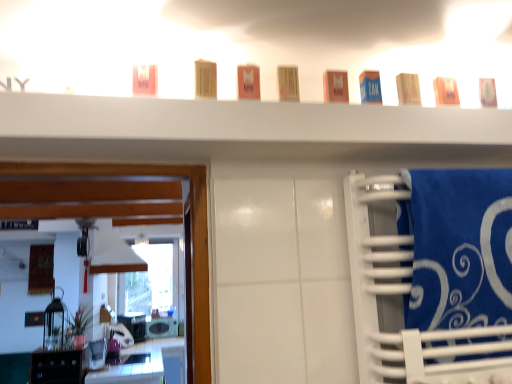
The image size is (512, 384). What are the coordinates of `matte orange soap at upper right, which ranks as the eighth toiletry in left-to-right order` in the screenshot? It's located at (446, 91).

Describe the element at coordinates (97, 354) in the screenshot. I see `metallic silver toaster at lower left, which appears as the first appliance when viewed from the front` at that location.

Based on the photo, in order to face metallic silver toaster at lower left, the second appliance when ordered from back to front, should I rotate leftwards or rightwards?

It's best to rotate left around 20.019 degrees.

Where is `matte orange box at center, positioned as the 4th toiletry in right-to-left order`? Image resolution: width=512 pixels, height=384 pixels. matte orange box at center, positioned as the 4th toiletry in right-to-left order is located at coordinates (335, 86).

You are a GUI agent. You are given a task and a screenshot of the screen. Output one action in this format:
    pyautogui.click(x=<x>, y=<y>)
    Task: Click on the matte beige soap at upper right, the 2th toiletry in the right-to-left sequence
    Image resolution: width=512 pixels, height=384 pixels.
    Given the screenshot: What is the action you would take?
    pyautogui.click(x=408, y=89)

Where is `matte orange soap at upper right, which ranks as the eighth toiletry in left-to-right order`? matte orange soap at upper right, which ranks as the eighth toiletry in left-to-right order is located at coordinates (446, 91).

Does glossy white vanity at lower left contain orange matte box at center, which is the 6th toiletry in right-to-left order?

No, orange matte box at center, which is the 6th toiletry in right-to-left order, is located outside of glossy white vanity at lower left.

From the image's perspective, is glossy white vanity at lower left located above or below orange matte box at center, which is the 6th toiletry in right-to-left order?

Based on their image positions, glossy white vanity at lower left is located beneath orange matte box at center, which is the 6th toiletry in right-to-left order.

From a real-world perspective, which is physically above, glossy white vanity at lower left or orange matte box at center, which is the 6th toiletry in right-to-left order?

orange matte box at center, which is the 6th toiletry in right-to-left order, is physically above.

Can you confirm if wooden block at center, placed as the second toiletry when sorted from left to right, is wider than white matte vent at center?

No, wooden block at center, placed as the second toiletry when sorted from left to right, is not wider than white matte vent at center.

Identify the location of vent below the wooden block at center, the 7th toiletry when ordered from right to left (from the image's perspective). The height and width of the screenshot is (384, 512). (113, 252).

Consider the image. From the image's perspective, between wooden block at center, placed as the second toiletry when sorted from left to right, and white matte vent at center, who is located below?

white matte vent at center is shown below in the image.

From a real-world perspective, relative to blue cardboard box at upper center, which is the sixth toiletry in left-to-right order, is wooden block at center, the 7th toiletry when ordered from right to left, vertically above or below?

Clearly, from a real-world perspective, wooden block at center, the 7th toiletry when ordered from right to left, is above blue cardboard box at upper center, which is the sixth toiletry in left-to-right order.

Which is more to the right, wooden block at center, placed as the second toiletry when sorted from left to right, or blue cardboard box at upper center, the third toiletry from the right?

From the viewer's perspective, blue cardboard box at upper center, the third toiletry from the right, appears more on the right side.

Does wooden block at center, the 7th toiletry when ordered from right to left, have a larger size compared to blue cardboard box at upper center, which is the sixth toiletry in left-to-right order?

Yes, wooden block at center, the 7th toiletry when ordered from right to left, is bigger than blue cardboard box at upper center, which is the sixth toiletry in left-to-right order.

Is point (443, 82) positioned before point (45, 353)?

Yes, point (443, 82) is closer to viewer.

Would you say matte orange soap at upper right, arranged as the 1th toiletry when viewed from the right, is to the left or to the right of black glossy cabinet at lower left in the picture?

In the image, matte orange soap at upper right, arranged as the 1th toiletry when viewed from the right, appears on the right side of black glossy cabinet at lower left.

From a real-world perspective, is matte orange soap at upper right, which ranks as the eighth toiletry in left-to-right order, physically located above or below black glossy cabinet at lower left?

Clearly, from a real-world perspective, matte orange soap at upper right, which ranks as the eighth toiletry in left-to-right order, is above black glossy cabinet at lower left.

Locate an element on the screen. This screenshot has height=384, width=512. cabinetry below the matte orange soap at upper right, which ranks as the eighth toiletry in left-to-right order (from a real-world perspective) is located at coordinates (58, 366).

Is point (451, 92) positioned before point (325, 97)?

That is False.

Which is more to the left, matte orange soap at upper right, arranged as the 1th toiletry when viewed from the right, or matte orange box at center, acting as the fifth toiletry starting from the left?

matte orange box at center, acting as the fifth toiletry starting from the left.

Is matte orange soap at upper right, which ranks as the eighth toiletry in left-to-right order, facing towards matte orange box at center, acting as the fifth toiletry starting from the left?

No.

Considering the sizes of matte orange soap at upper right, arranged as the 1th toiletry when viewed from the right, and matte orange box at center, positioned as the 4th toiletry in right-to-left order, in the image, is matte orange soap at upper right, arranged as the 1th toiletry when viewed from the right, wider or thinner than matte orange box at center, positioned as the 4th toiletry in right-to-left order,?

matte orange soap at upper right, arranged as the 1th toiletry when viewed from the right, is wider than matte orange box at center, positioned as the 4th toiletry in right-to-left order.

Considering the sizes of objects matte pink soap at upper left, arranged as the 1th toiletry when viewed from the left, and matte orange box at center, acting as the fifth toiletry starting from the left, in the image provided, who is wider, matte pink soap at upper left, arranged as the 1th toiletry when viewed from the left, or matte orange box at center, acting as the fifth toiletry starting from the left,?

matte orange box at center, acting as the fifth toiletry starting from the left.

Is matte orange box at center, positioned as the 4th toiletry in right-to-left order, surrounded by matte pink soap at upper left, arranged as the 1th toiletry when viewed from the left?

No, matte pink soap at upper left, arranged as the 1th toiletry when viewed from the left, does not contain matte orange box at center, positioned as the 4th toiletry in right-to-left order.

Looking at this image, are matte pink soap at upper left, acting as the eighth toiletry starting from the right, and matte orange box at center, positioned as the 4th toiletry in right-to-left order, far apart?

matte pink soap at upper left, acting as the eighth toiletry starting from the right, is near matte orange box at center, positioned as the 4th toiletry in right-to-left order, not far away.

Is blue soft towel at right located outside matte orange soap at upper right, arranged as the 1th toiletry when viewed from the right?

Yes, blue soft towel at right is located beyond the bounds of matte orange soap at upper right, arranged as the 1th toiletry when viewed from the right.

Considering the positions of objects blue soft towel at right and matte orange soap at upper right, arranged as the 1th toiletry when viewed from the right, in the image provided, who is in front, blue soft towel at right or matte orange soap at upper right, arranged as the 1th toiletry when viewed from the right,?

blue soft towel at right is more forward.

Is blue soft towel at right next to matte orange soap at upper right, which ranks as the eighth toiletry in left-to-right order, and touching it?

No, blue soft towel at right is not making contact with matte orange soap at upper right, which ranks as the eighth toiletry in left-to-right order.

Considering the positions of objects blue soft towel at right and matte orange soap at upper right, arranged as the 1th toiletry when viewed from the right, in the image provided, who is more to the left, blue soft towel at right or matte orange soap at upper right, arranged as the 1th toiletry when viewed from the right,?

matte orange soap at upper right, arranged as the 1th toiletry when viewed from the right, is more to the left.

This screenshot has height=384, width=512. There is a glossy white vanity at lower left. In order to click on the 4th toiletry above it (from the image's perspective) in this screenshot , I will do `click(248, 82)`.

Starting from the white matte vent at center, which toiletry is the 2nd one to the right? Please provide its 2D coordinates.

[(205, 79)]

Which object lies further to the anchor point matte plastic container at center, the 5th toiletry from the right, blue soft towel at right or matte orange soap at upper right, arranged as the 1th toiletry when viewed from the right?

blue soft towel at right is further to matte plastic container at center, the 5th toiletry from the right.

Estimate the real-world distances between objects in this image. Which object is further from white matte vent at center, matte beige soap at upper right, the 2th toiletry in the right-to-left sequence, or blue cardboard box at upper center, which is the sixth toiletry in left-to-right order?

matte beige soap at upper right, the 2th toiletry in the right-to-left sequence, is positioned further to the anchor white matte vent at center.

Which object lies further to the anchor point black glossy cabinet at lower left, matte plastic container at center, the 4th toiletry positioned from the left, or matte orange soap at upper right, which ranks as the eighth toiletry in left-to-right order?

Based on the image, matte orange soap at upper right, which ranks as the eighth toiletry in left-to-right order, appears to be further to black glossy cabinet at lower left.

Estimate the real-world distances between objects in this image. Which object is closer to wooden block at center, the 7th toiletry when ordered from right to left, glossy white vanity at lower left or black glossy cabinet at lower left?

black glossy cabinet at lower left is closer to wooden block at center, the 7th toiletry when ordered from right to left.

Based on their spatial positions, is matte pink soap at upper left, acting as the eighth toiletry starting from the right, or matte beige soap at upper right, which ranks as the seventh toiletry in left-to-right order, further from matte plastic container at center, the 5th toiletry from the right?

matte pink soap at upper left, acting as the eighth toiletry starting from the right, is positioned further to the anchor matte plastic container at center, the 5th toiletry from the right.

Looking at the image, which one is located further to matte plastic container at center, the 4th toiletry positioned from the left, matte orange soap at upper right, which ranks as the eighth toiletry in left-to-right order, or orange matte box at center, the third toiletry when ordered from left to right?

matte orange soap at upper right, which ranks as the eighth toiletry in left-to-right order, lies further to matte plastic container at center, the 4th toiletry positioned from the left, than the other object.

Based on their spatial positions, is black glossy cabinet at lower left or glossy white vanity at lower left closer to matte orange soap at upper right, which ranks as the eighth toiletry in left-to-right order?

The object closer to matte orange soap at upper right, which ranks as the eighth toiletry in left-to-right order, is black glossy cabinet at lower left.

When comparing their distances from blue soft towel at right, does black glossy cabinet at lower left or orange matte box at center, which is the 6th toiletry in right-to-left order, seem closer?

The object closer to blue soft towel at right is orange matte box at center, which is the 6th toiletry in right-to-left order.

Find the location of a particular element. The width and height of the screenshot is (512, 384). appliance between matte orange soap at upper right, which ranks as the eighth toiletry in left-to-right order, and white matte vent at center in the front-back direction is located at coordinates (97, 354).

Identify the location of cabinetry positioned between matte plastic container at center, the 5th toiletry from the right, and glossy white vanity at lower left from near to far. Image resolution: width=512 pixels, height=384 pixels. (58, 366).

At what (x,y) coordinates should I click in order to perform the action: click on vanity between blue cardboard box at upper center, which is the sixth toiletry in left-to-right order, and white glossy microwave at lower left, which appears as the second appliance when viewed from the top, in the front-back direction. Please return your answer as a coordinate pair (x, y). Looking at the image, I should click on (132, 369).

You are a GUI agent. You are given a task and a screenshot of the screen. Output one action in this format:
    pyautogui.click(x=<x>, y=<y>)
    Task: Click on the appliance between blue cardboard box at upper center, which is the sixth toiletry in left-to-right order, and white glossy microwave at lower left, which appears as the second appliance when viewed from the top, in the front-back direction
    Image resolution: width=512 pixels, height=384 pixels.
    Given the screenshot: What is the action you would take?
    pyautogui.click(x=97, y=354)